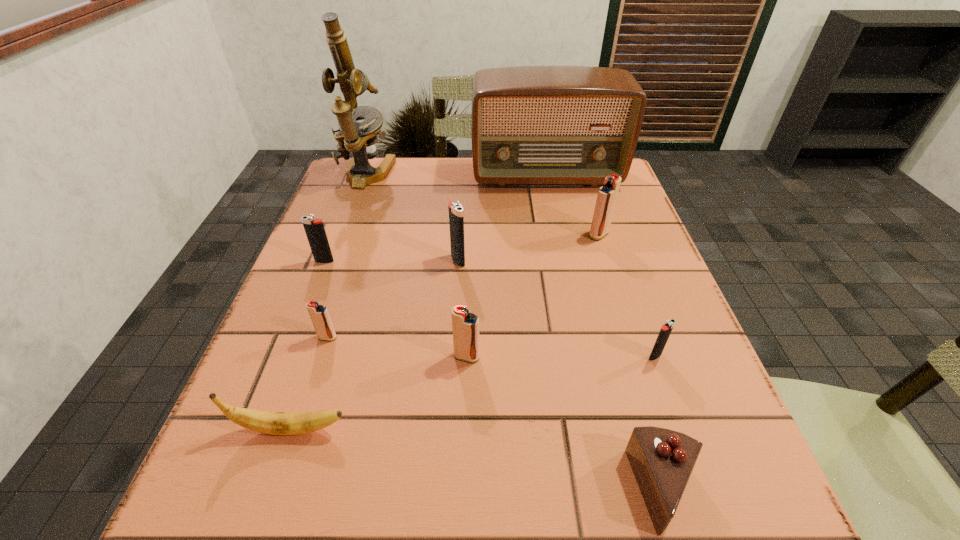
Locate an element on the screen. Image resolution: width=960 pixels, height=540 pixels. microscope is located at coordinates (359, 138).

Where is `radio receiver`? The image size is (960, 540). radio receiver is located at coordinates [x=553, y=124].

At what (x,y) coordinates should I click in order to perform the action: click on the farthest igniter. Please return your answer as a coordinate pair (x, y). Image resolution: width=960 pixels, height=540 pixels. Looking at the image, I should click on (607, 195).

This screenshot has height=540, width=960. Find the location of `the rightmost red igniter`. the rightmost red igniter is located at coordinates (607, 195).

In order to click on the biggest black igniter in this screenshot , I will do `click(456, 216)`.

I want to click on the second biggest black igniter, so click(x=314, y=228).

Image resolution: width=960 pixels, height=540 pixels. Identify the location of the leftmost igniter. (314, 228).

You are a GUI agent. You are given a task and a screenshot of the screen. Output one action in this format:
    pyautogui.click(x=<x>, y=<y>)
    Task: Click on the second red igniter from left to right
    
    Given the screenshot: What is the action you would take?
    pyautogui.click(x=465, y=326)

Where is `the second smallest red igniter`? The height and width of the screenshot is (540, 960). the second smallest red igniter is located at coordinates point(465,326).

Find the location of a particular element. the second nearest object is located at coordinates (276, 423).